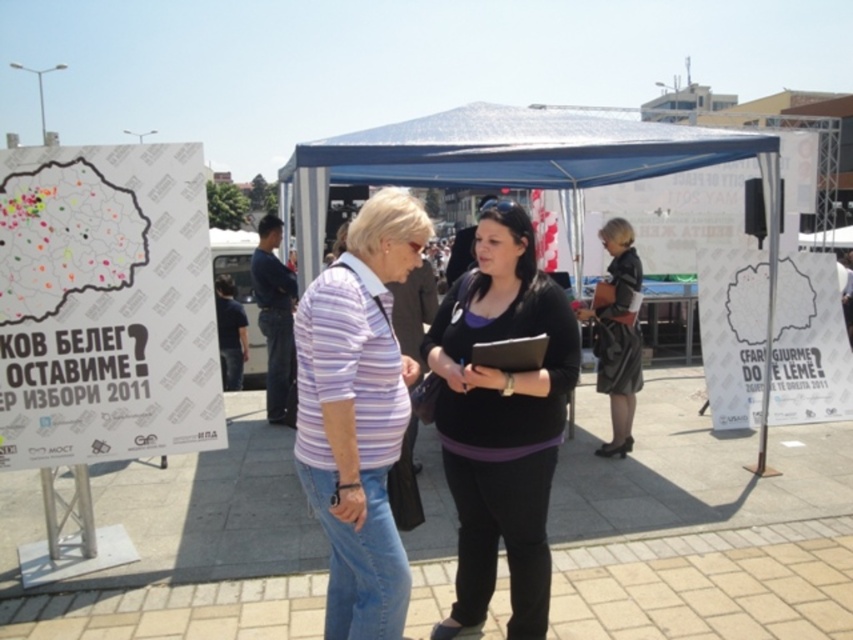
Between point (492, 532) and point (631, 246), which one is positioned in front?

Positioned in front is point (492, 532).

Identify the location of black matte shirt at center. The width and height of the screenshot is (853, 640). (502, 420).

Who is more forward, (471, 291) or (628, 401)?

Positioned in front is point (471, 291).

Identify the location of black matte shirt at center. (502, 420).

Find the location of a particular element. purple striped shirt at center is located at coordinates (358, 413).

Does purple striped shirt at center have a greater width compared to black leather skirt at center?

In fact, purple striped shirt at center might be narrower than black leather skirt at center.

Between point (346, 500) and point (599, 236), which one is positioned in front?

Point (346, 500) is in front.

This screenshot has width=853, height=640. I want to click on purple striped shirt at center, so click(358, 413).

Identify the location of black matte shirt at center. This screenshot has height=640, width=853. (502, 420).

Can you confirm if black matte shirt at center is taller than purple striped shirt at center?

Indeed, black matte shirt at center has a greater height compared to purple striped shirt at center.

I want to click on black matte shirt at center, so click(502, 420).